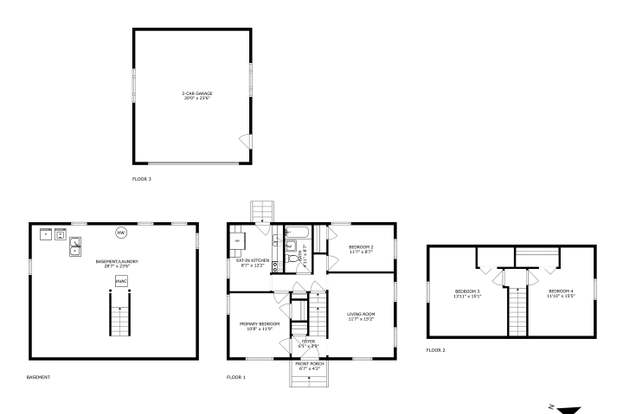
This screenshot has height=414, width=623. What are the coordinates of `bath` in the screenshot? It's located at (292, 231).